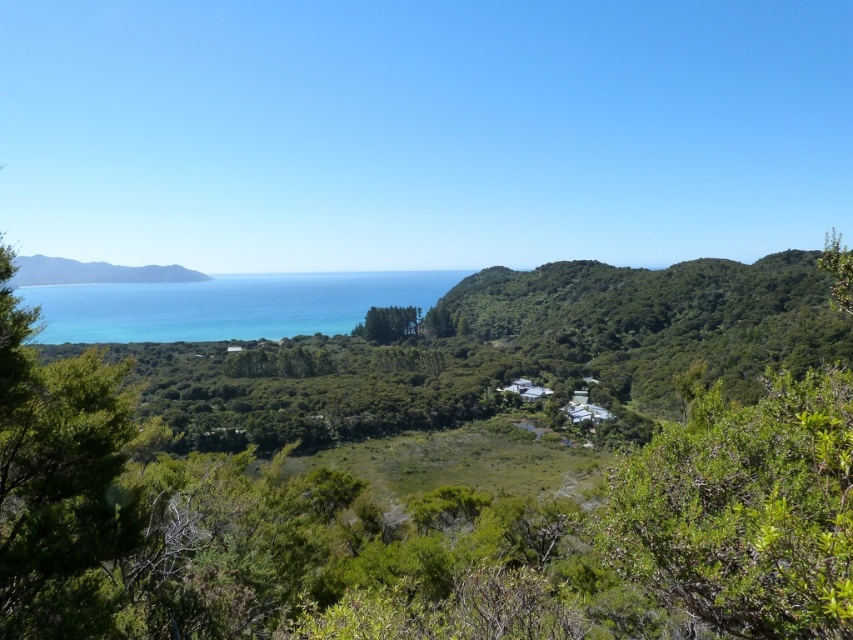
Is green leafy bush at center-right closer to camera compared to blue water at center?

That is True.

Is point (828, 612) farther from viewer compared to point (254, 301)?

No, (828, 612) is in front of (254, 301).

This screenshot has width=853, height=640. In order to click on green leafy bush at center-right in this screenshot , I will do `click(746, 509)`.

Consider the image. Can you confirm if green leafy bush at center-right is positioned below green grassy hillside at left?

Indeed, green leafy bush at center-right is positioned under green grassy hillside at left.

Find the location of a particular element. Image resolution: width=853 pixels, height=640 pixels. green leafy bush at center-right is located at coordinates (746, 509).

What do you see at coordinates (746, 509) in the screenshot?
I see `green leafy bush at center-right` at bounding box center [746, 509].

This screenshot has height=640, width=853. Identify the location of green leafy bush at center-right. (746, 509).

Is green leafy bush at center-right bigger than green leafy tree at center?

No, green leafy bush at center-right is not bigger than green leafy tree at center.

Does point (738, 433) come behind point (408, 333)?

No, it is in front of (408, 333).

Image resolution: width=853 pixels, height=640 pixels. Identify the location of green leafy bush at center-right. (746, 509).